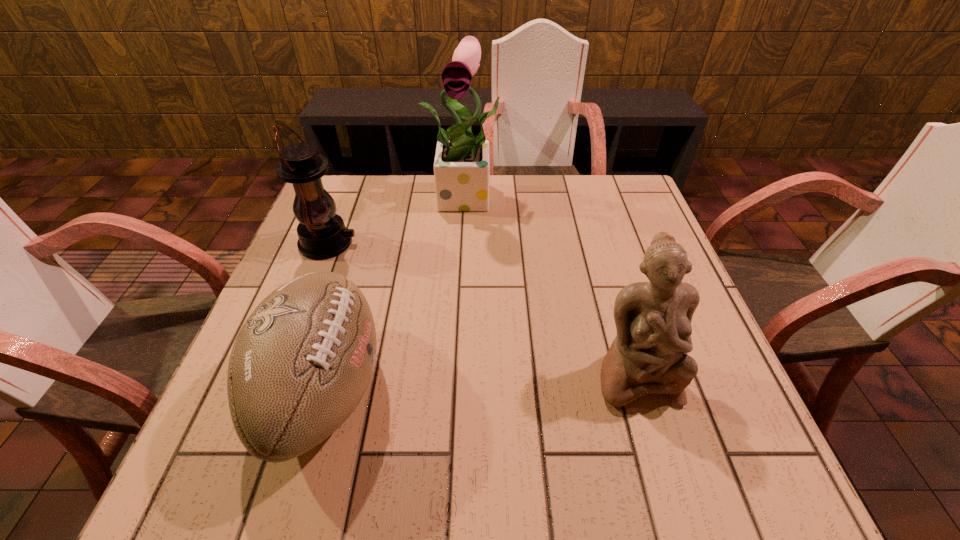
Image resolution: width=960 pixels, height=540 pixels. In order to click on object at the near edge in this screenshot , I will do `click(303, 360)`.

Where is `lantern that is at the left edge`? This screenshot has height=540, width=960. lantern that is at the left edge is located at coordinates (322, 234).

At what (x,y) coordinates should I click in order to perform the action: click on football (American) situated at the left edge. Please return your answer as a coordinate pair (x, y). The width and height of the screenshot is (960, 540). Looking at the image, I should click on (303, 360).

Identify the location of object at the right edge. The image size is (960, 540). (653, 319).

Locate an element on the screen. This screenshot has height=540, width=960. object that is at the near left corner is located at coordinates (303, 360).

The image size is (960, 540). What are the coordinates of `free space at the far edge` in the screenshot? It's located at pos(398,200).

The height and width of the screenshot is (540, 960). I want to click on vacant space at the near edge of the desktop, so click(x=364, y=460).

I want to click on vacant space at the left edge, so click(x=282, y=277).

At what (x,y) coordinates should I click in order to perform the action: click on vacant space at the right edge of the desktop. Please return your answer as a coordinate pair (x, y). This screenshot has height=540, width=960. Looking at the image, I should click on (697, 346).

You are a GUI agent. You are given a task and a screenshot of the screen. Output one action in this format:
    pyautogui.click(x=<x>, y=<y>)
    Task: Click on the vacant space at the far left corner of the desktop
    The height and width of the screenshot is (540, 960).
    Given the screenshot: What is the action you would take?
    pos(375,189)